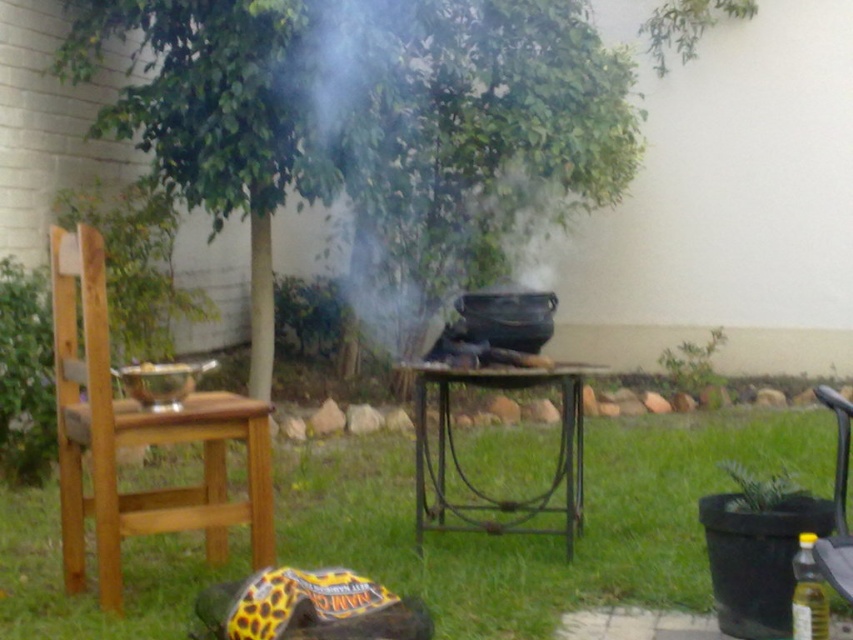
Question: Observing the image, what is the correct spatial positioning of wooden chair at left in reference to black plastic chair at lower right?

Choices:
 (A) below
 (B) above

Answer: (B)

Question: Which point is closer to the camera?

Choices:
 (A) (488, 372)
 (B) (108, 378)
 (C) (842, 472)
 (D) (178, 554)

Answer: (B)

Question: Does green grass at lower center appear on the left side of black plastic chair at lower right?

Choices:
 (A) yes
 (B) no

Answer: (B)

Question: Which point is farther to the camera?

Choices:
 (A) (424, 496)
 (B) (837, 570)
 (C) (627, 445)
 (D) (76, 468)

Answer: (C)

Question: Which of the following is the farthest from the observer?

Choices:
 (A) (848, 541)
 (B) (416, 480)
 (C) (535, 428)

Answer: (C)

Question: Is the position of green grass at lower center less distant than that of wooden chair at left?

Choices:
 (A) no
 (B) yes

Answer: (A)